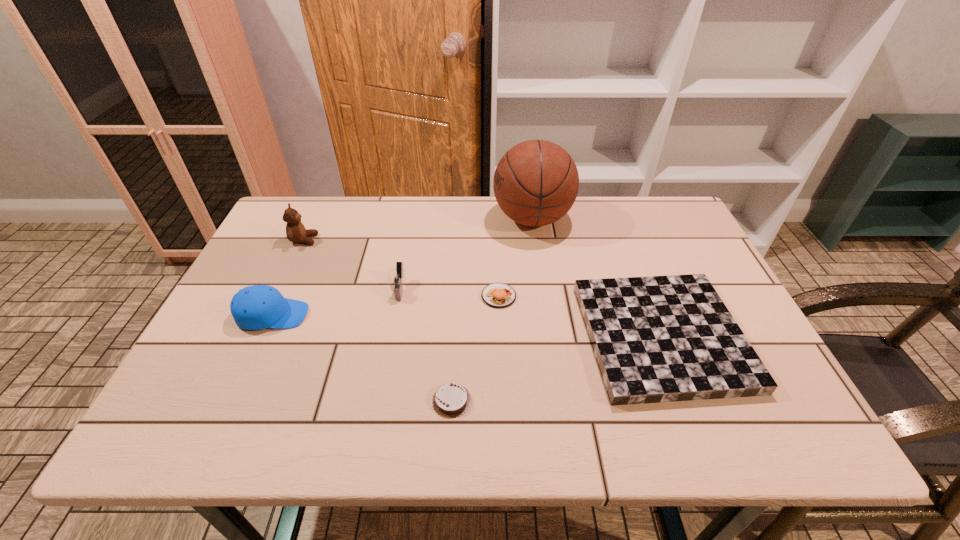
What are the coordinates of `chocolate cake at the near edge` in the screenshot? It's located at (451, 400).

Where is `teddy bear at the left edge`? teddy bear at the left edge is located at coordinates (295, 231).

Where is `cap that is at the left edge`? The image size is (960, 540). cap that is at the left edge is located at coordinates (256, 307).

You are a GUI agent. You are given a task and a screenshot of the screen. Output one action in this format:
    pyautogui.click(x=<x>, y=<y>)
    Task: Click on the object located at the right edge
    The image size is (960, 540).
    Given the screenshot: What is the action you would take?
    pyautogui.click(x=656, y=339)

Locate an element on the screen. object that is at the far left corner is located at coordinates (295, 231).

Locate an element on the screen. object positioned at the near right corner is located at coordinates (656, 339).

The height and width of the screenshot is (540, 960). In order to click on free space at the far edge in this screenshot , I will do `click(627, 227)`.

At what (x,y) coordinates should I click in order to perform the action: click on free space at the left edge of the desktop. Please return your answer as a coordinate pair (x, y). This screenshot has height=540, width=960. Looking at the image, I should click on (216, 398).

Find the location of a particular element. The height and width of the screenshot is (540, 960). free space at the right edge of the desktop is located at coordinates (664, 254).

The height and width of the screenshot is (540, 960). In the image, there is a desktop. What are the coordinates of `vacant space at the far left corner` in the screenshot? It's located at (288, 199).